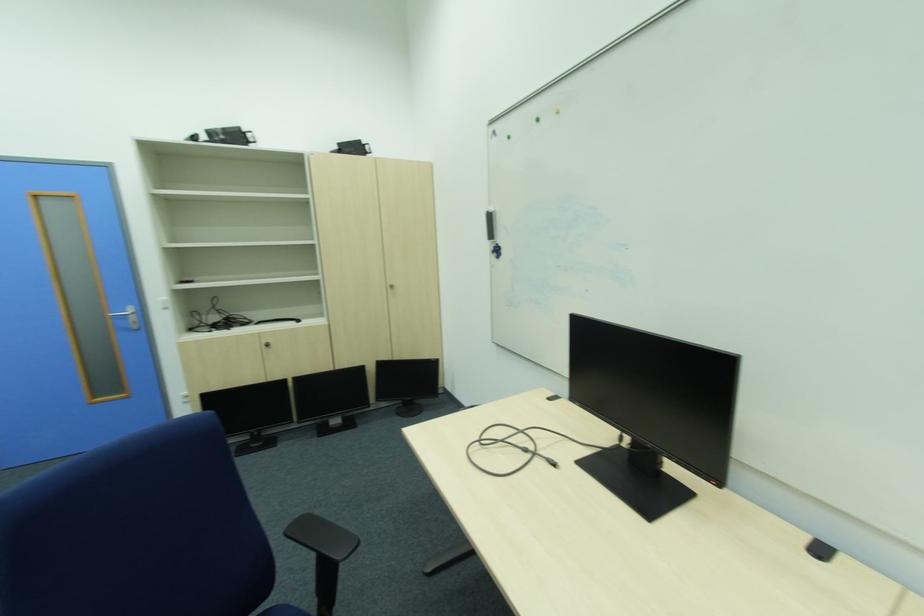
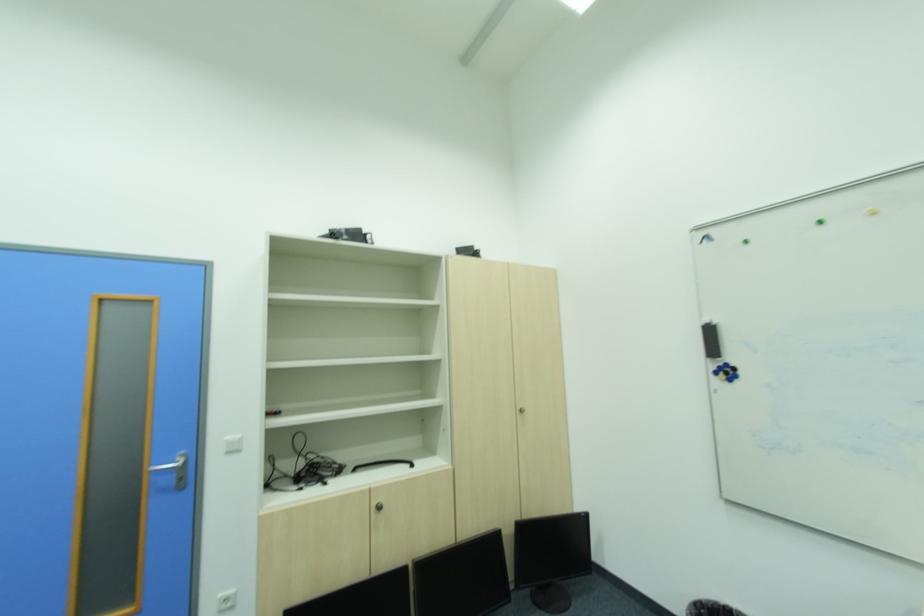
In the second image, find the point that corresponds to pixel 44 198 in the first image.

(111, 300)